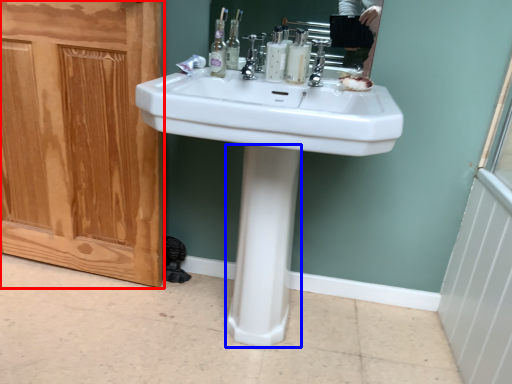
Question: Among these objects, which one is farthest to the camera, screen door (highlighted by a red box) or bidet (highlighted by a blue box)?

Choices:
 (A) screen door
 (B) bidet

Answer: (A)